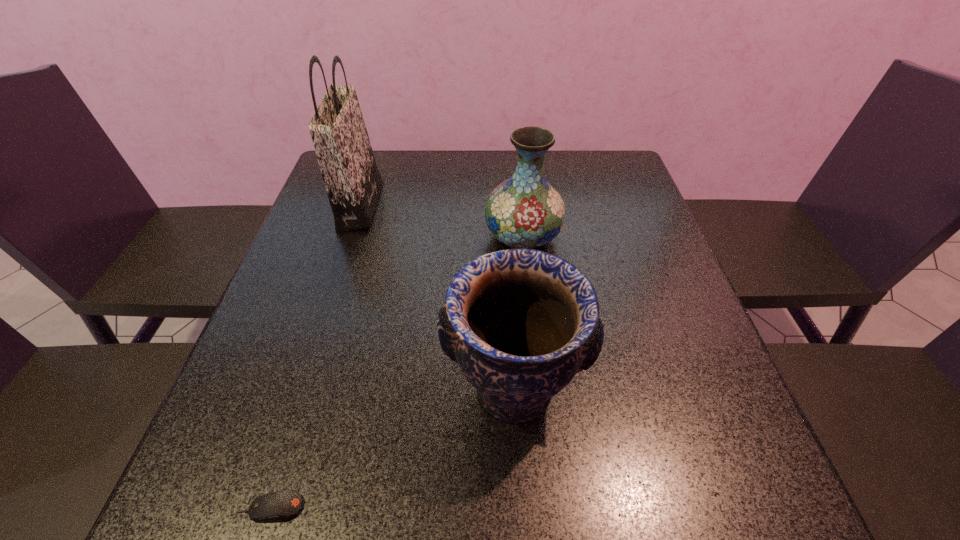
The width and height of the screenshot is (960, 540). What are the coordinates of `shopping bag at the left edge` in the screenshot? It's located at (352, 180).

Find the location of a particular element. The width and height of the screenshot is (960, 540). computer mouse at the left edge is located at coordinates (277, 506).

Locate an element on the screen. Image resolution: width=960 pixels, height=540 pixels. object positioned at the far left corner is located at coordinates (352, 180).

Image resolution: width=960 pixels, height=540 pixels. I want to click on object at the near left corner, so click(x=277, y=506).

The image size is (960, 540). Find the location of `free point at the near edge`. free point at the near edge is located at coordinates (581, 493).

The image size is (960, 540). In the image, there is a desktop. Find the location of `free space at the left edge`. free space at the left edge is located at coordinates (284, 295).

Where is `vacant space at the right edge of the desktop`? Image resolution: width=960 pixels, height=540 pixels. vacant space at the right edge of the desktop is located at coordinates (660, 260).

This screenshot has height=540, width=960. In the image, there is a desktop. In order to click on vacant space at the near left corner in this screenshot , I will do `click(209, 467)`.

The image size is (960, 540). Find the location of `blank space at the far right corner of the desktop`. blank space at the far right corner of the desktop is located at coordinates (590, 181).

Locate an element on the screen. This screenshot has height=540, width=960. free point between the tallest object and the second nearest object is located at coordinates (437, 298).